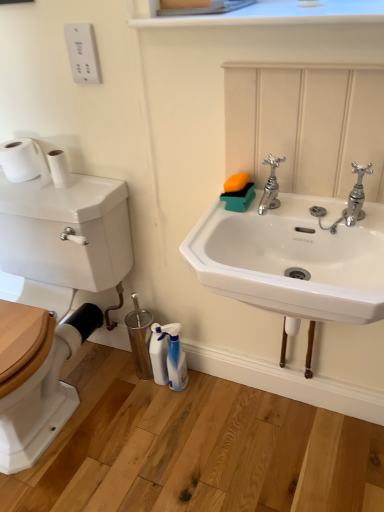
Question: Is white matte toilet paper at left, positioned as the second toilet paper in left-to-right order, taller or shorter than white matte toilet paper at left, which is counted as the 2th toilet paper, starting from the right?

Choices:
 (A) tall
 (B) short

Answer: (B)

Question: Looking at their shapes, would you say white matte toilet paper at left, positioned as the second toilet paper in left-to-right order, is wider or thinner than white matte toilet paper at left, which is counted as the 2th toilet paper, starting from the right?

Choices:
 (A) wide
 (B) thin

Answer: (B)

Question: Which is nearer to the chrome metallic faucet at upper right, which appears as the second tap when viewed from the left?

Choices:
 (A) chrome metallic faucet at upper center, the second tap viewed from the right
 (B) white smooth window sill at upper center
 (C) white matte toilet paper at left, which is counted as the 2th toilet paper, starting from the right
 (D) white glossy spray bottle at lower center, the 1th cleaning product viewed from the right
 (E) white glossy toilet tank at left

Answer: (A)

Question: Considering the real-world distances, which object is farthest from the white matte toilet paper at left, positioned as the second toilet paper in left-to-right order?

Choices:
 (A) white matte toilet paper at left, which is counted as the 2th toilet paper, starting from the right
 (B) white glossy spray bottle at lower center, the 1th cleaning product viewed from the right
 (C) white plastic spray bottle at lower center, which ranks as the first cleaning product in left-to-right order
 (D) white glossy toilet tank at left
 (E) white ceramic sink at center

Answer: (B)